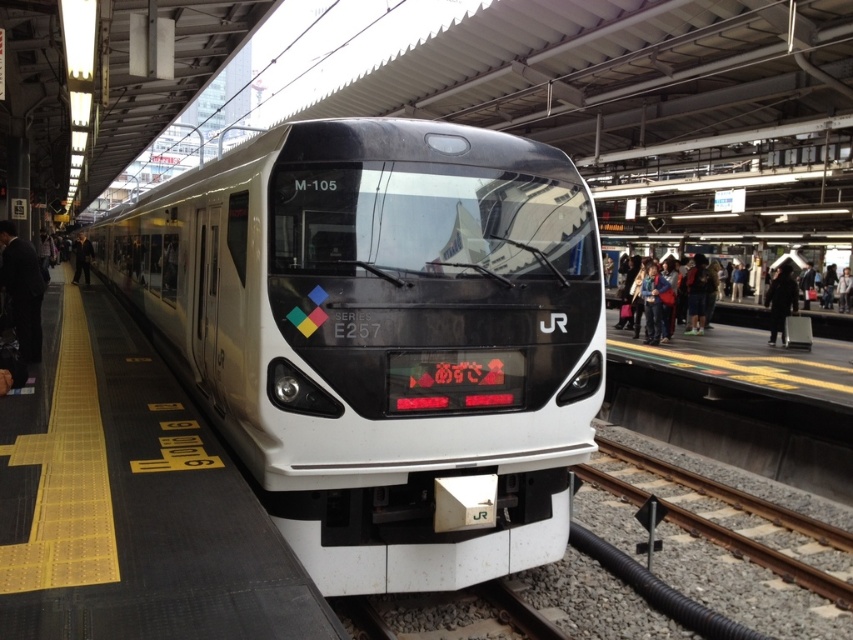
Question: Which object appears farthest from the camera in this image?

Choices:
 (A) black wool coat at center
 (B) black suit at left

Answer: (B)

Question: Can you confirm if blue denim jacket at right is wider than black suit at left?

Choices:
 (A) no
 (B) yes

Answer: (A)

Question: Which point appears farthest from the camera in this image?

Choices:
 (A) (152, 208)
 (B) (772, 301)

Answer: (B)

Question: Can you confirm if matte black train at center is smaller than white smooth platform at center?

Choices:
 (A) yes
 (B) no

Answer: (B)

Question: Does black wool coat at center appear on the left side of black suit at left?

Choices:
 (A) no
 (B) yes

Answer: (A)

Question: Which object is closer to the camera taking this photo?

Choices:
 (A) black suit at left
 (B) matte black train at center
 (C) black wool coat at center
 (D) blue denim jacket at right

Answer: (B)